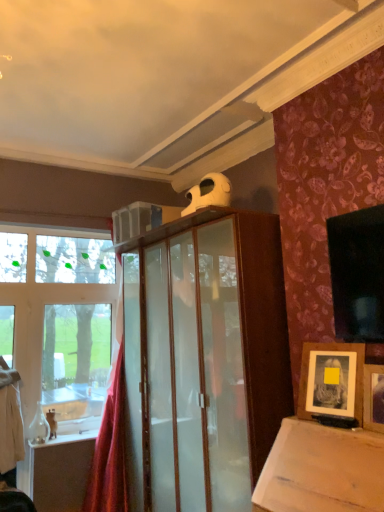
What is the approximate height of red velvet curtain at left?

4.75 feet.

In order to click on wooden picture frame at upper right, placed as the second picture frame when sorted from back to front in this screenshot , I will do `click(373, 398)`.

You are a GUI agent. You are given a task and a screenshot of the screen. Output one action in this format:
    pyautogui.click(x=<x>, y=<y>)
    Task: Click on the red velvet curtain at left
    This screenshot has height=512, width=384.
    Given the screenshot: What is the action you would take?
    pyautogui.click(x=110, y=449)

Is the depth of red velvet curtain at left greater than that of wooden picture frame at upper right, which ranks as the first picture frame in front-to-back order?

Yes, red velvet curtain at left is further from the camera.

From the image's perspective, does red velvet curtain at left appear higher than wooden picture frame at upper right, placed as the second picture frame when sorted from back to front?

Incorrect, from the image's perspective, red velvet curtain at left is lower than wooden picture frame at upper right, placed as the second picture frame when sorted from back to front.

Where is `the 2nd picture frame counting from the right side of the red velvet curtain at left`? The height and width of the screenshot is (512, 384). the 2nd picture frame counting from the right side of the red velvet curtain at left is located at coordinates (373, 398).

Looking at this image, between red velvet curtain at left and wooden picture frame at upper right, which ranks as the first picture frame in front-to-back order, which one has smaller width?

Thinner between the two is wooden picture frame at upper right, which ranks as the first picture frame in front-to-back order.

From the image's perspective, is wooden picture frame at upper right, which ranks as the first picture frame in front-to-back order, located beneath wooden framed photo at lower right, the 2th picture frame when ordered from front to back?

Yes.

Considering the relative positions of wooden picture frame at upper right, which ranks as the first picture frame in front-to-back order, and wooden framed photo at lower right, the 2th picture frame when ordered from front to back, in the image provided, is wooden picture frame at upper right, which ranks as the first picture frame in front-to-back order, to the left or to the right of wooden framed photo at lower right, the 2th picture frame when ordered from front to back,?

Based on their positions, wooden picture frame at upper right, which ranks as the first picture frame in front-to-back order, is located to the right of wooden framed photo at lower right, the 2th picture frame when ordered from front to back.

From a real-world perspective, is wooden picture frame at upper right, placed as the second picture frame when sorted from back to front, beneath wooden framed photo at lower right, the 2th picture frame when ordered from front to back?

Yes, from a real-world perspective, wooden picture frame at upper right, placed as the second picture frame when sorted from back to front, is beneath wooden framed photo at lower right, the 2th picture frame when ordered from front to back.

From a real-world perspective, is wooden framed photo at lower right, the 2th picture frame when ordered from front to back, positioned above or below wooden picture frame at upper right, which ranks as the first picture frame in front-to-back order?

wooden framed photo at lower right, the 2th picture frame when ordered from front to back, is situated higher than wooden picture frame at upper right, which ranks as the first picture frame in front-to-back order, in the real world.

Between point (305, 406) and point (379, 393), which one is positioned behind?

The point (305, 406) is farther.

Which of these two, wooden framed photo at lower right, the 2th picture frame when ordered from front to back, or wooden picture frame at upper right, placed as the second picture frame when sorted from back to front, stands shorter?

wooden picture frame at upper right, placed as the second picture frame when sorted from back to front.

In the image, is wooden framed photo at lower right, the first picture frame viewed from the back, positioned in front of or behind red velvet curtain at left?

wooden framed photo at lower right, the first picture frame viewed from the back, is positioned closer to the viewer than red velvet curtain at left.

Considering the sizes of wooden framed photo at lower right, the first picture frame viewed from the back, and red velvet curtain at left in the image, is wooden framed photo at lower right, the first picture frame viewed from the back, taller or shorter than red velvet curtain at left?

wooden framed photo at lower right, the first picture frame viewed from the back, is shorter than red velvet curtain at left.

Can you tell me how much wooden framed photo at lower right, the 2th picture frame when ordered from front to back, and red velvet curtain at left differ in facing direction?

There is a 75.9-degree angle between the facing directions of wooden framed photo at lower right, the 2th picture frame when ordered from front to back, and red velvet curtain at left.

From the image's perspective, which one is positioned higher, wooden framed photo at lower right, the 2th picture frame when ordered from front to back, or red velvet curtain at left?

wooden framed photo at lower right, the 2th picture frame when ordered from front to back, from the image's perspective.

Is wooden picture frame at upper right, which ranks as the first picture frame in front-to-back order, wider or thinner than red velvet curtain at left?

In the image, wooden picture frame at upper right, which ranks as the first picture frame in front-to-back order, appears to be more narrow than red velvet curtain at left.

Which of these two, wooden picture frame at upper right, placed as the second picture frame when sorted from back to front, or red velvet curtain at left, stands taller?

red velvet curtain at left is taller.

Is wooden picture frame at upper right, placed as the second picture frame when sorted from back to front, touching red velvet curtain at left?

No, wooden picture frame at upper right, placed as the second picture frame when sorted from back to front, is not in contact with red velvet curtain at left.

Consider the image. Could you tell me if wooden picture frame at upper right, which ranks as the first picture frame in front-to-back order, is turned towards red velvet curtain at left?

No, wooden picture frame at upper right, which ranks as the first picture frame in front-to-back order, does not turn towards red velvet curtain at left.

How many degrees apart are the facing directions of red velvet curtain at left and wooden framed photo at lower right, the 2th picture frame when ordered from front to back?

75.9 degrees.

From a real-world perspective, which is physically below, red velvet curtain at left or wooden framed photo at lower right, the first picture frame viewed from the back?

From a 3D spatial view, red velvet curtain at left is below.

Considering the relative sizes of red velvet curtain at left and wooden framed photo at lower right, the 2th picture frame when ordered from front to back, in the image provided, is red velvet curtain at left bigger than wooden framed photo at lower right, the 2th picture frame when ordered from front to back,?

Yes.

The image size is (384, 512). What are the coordinates of `curtain lying behind the wooden framed photo at lower right, the 2th picture frame when ordered from front to back` in the screenshot? It's located at (110, 449).

This screenshot has width=384, height=512. Identify the location of curtain behind the wooden picture frame at upper right, which ranks as the first picture frame in front-to-back order. (110, 449).

Find the location of a particular element. The height and width of the screenshot is (512, 384). picture frame on the left of wooden picture frame at upper right, placed as the second picture frame when sorted from back to front is located at coordinates (308, 371).

Estimate the real-world distances between objects in this image. Which object is closer to wooden picture frame at upper right, which ranks as the first picture frame in front-to-back order, red velvet curtain at left or wooden framed photo at lower right, the 2th picture frame when ordered from front to back?

The object closer to wooden picture frame at upper right, which ranks as the first picture frame in front-to-back order, is wooden framed photo at lower right, the 2th picture frame when ordered from front to back.

From the picture: Estimate the real-world distances between objects in this image. Which object is closer to wooden picture frame at upper right, which ranks as the first picture frame in front-to-back order, wooden framed photo at lower right, the first picture frame viewed from the back, or red velvet curtain at left?

wooden framed photo at lower right, the first picture frame viewed from the back, is closer to wooden picture frame at upper right, which ranks as the first picture frame in front-to-back order.

Estimate the real-world distances between objects in this image. Which object is further from wooden framed photo at lower right, the first picture frame viewed from the back, wooden picture frame at upper right, which ranks as the first picture frame in front-to-back order, or red velvet curtain at left?

red velvet curtain at left is positioned further to the anchor wooden framed photo at lower right, the first picture frame viewed from the back.

From the image, which object appears to be farther from red velvet curtain at left, wooden framed photo at lower right, the 2th picture frame when ordered from front to back, or wooden picture frame at upper right, placed as the second picture frame when sorted from back to front?

wooden picture frame at upper right, placed as the second picture frame when sorted from back to front, is positioned further to the anchor red velvet curtain at left.

Which object lies nearer to the anchor point wooden framed photo at lower right, the 2th picture frame when ordered from front to back, red velvet curtain at left or wooden picture frame at upper right, placed as the second picture frame when sorted from back to front?

wooden picture frame at upper right, placed as the second picture frame when sorted from back to front, is closer to wooden framed photo at lower right, the 2th picture frame when ordered from front to back.

Which object lies nearer to the anchor point red velvet curtain at left, wooden picture frame at upper right, which ranks as the first picture frame in front-to-back order, or wooden framed photo at lower right, the 2th picture frame when ordered from front to back?

The object closer to red velvet curtain at left is wooden framed photo at lower right, the 2th picture frame when ordered from front to back.

What are the coordinates of `picture frame positioned between wooden picture frame at upper right, which ranks as the first picture frame in front-to-back order, and red velvet curtain at left from near to far` in the screenshot? It's located at (308, 371).